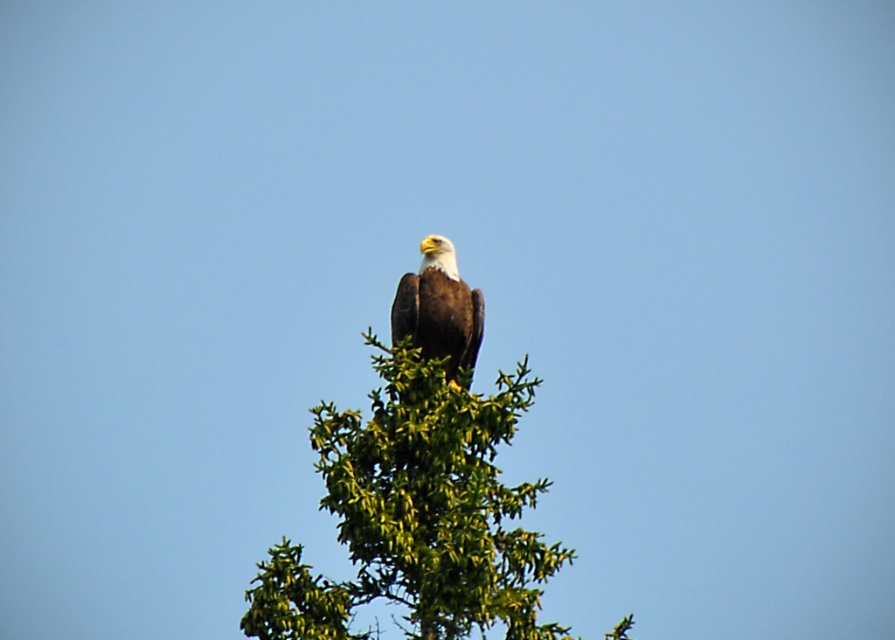
Question: Is green leafy tree at center positioned behind brown feathered eagle at center?

Choices:
 (A) yes
 (B) no

Answer: (B)

Question: Is green leafy tree at center further to camera compared to brown feathered eagle at center?

Choices:
 (A) yes
 (B) no

Answer: (B)

Question: Can you confirm if green leafy tree at center is positioned to the left of brown feathered eagle at center?

Choices:
 (A) yes
 (B) no

Answer: (A)

Question: Which of the following is the closest to the observer?

Choices:
 (A) brown feathered eagle at center
 (B) green leafy tree at center

Answer: (B)